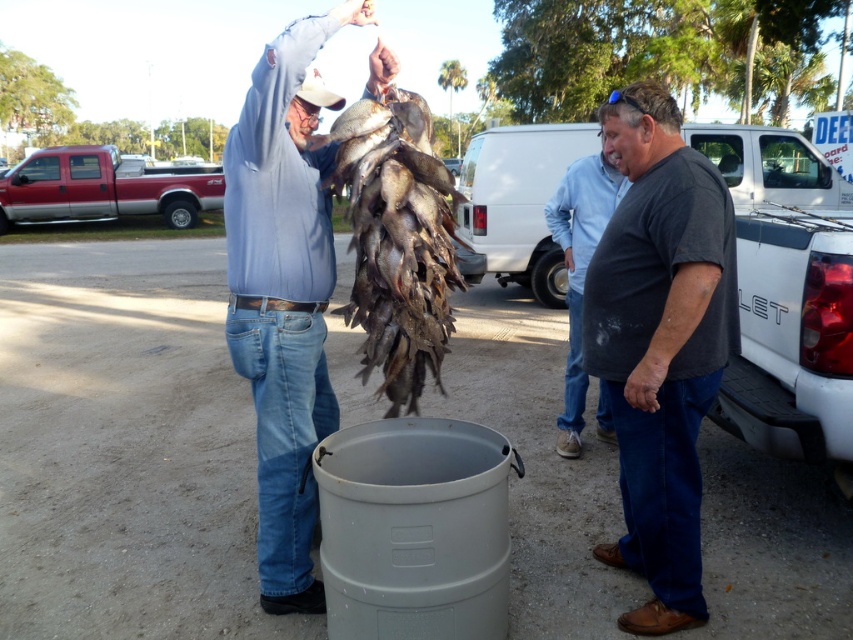
Question: Which object is the closest to the dark brown scales at upper center?

Choices:
 (A) light blue shirt at center
 (B) red metallic pickup truck at left

Answer: (A)

Question: Is light blue shirt at center positioned behind dark brown scales at upper center?

Choices:
 (A) yes
 (B) no

Answer: (B)

Question: Which point is farther from the camera taking this photo?

Choices:
 (A) (726, 195)
 (B) (181, 227)
 (C) (347, 308)

Answer: (B)

Question: Can you confirm if light blue shirt at center is wider than red metallic pickup truck at left?

Choices:
 (A) yes
 (B) no

Answer: (A)

Question: Is dark gray t-shirt at right to the right of dark brown scales at upper center from the viewer's perspective?

Choices:
 (A) no
 (B) yes

Answer: (B)

Question: Based on their relative distances, which object is nearer to the light blue shirt at center?

Choices:
 (A) dark gray t-shirt at right
 (B) dark gray shirt at right
 (C) red metallic pickup truck at left

Answer: (A)